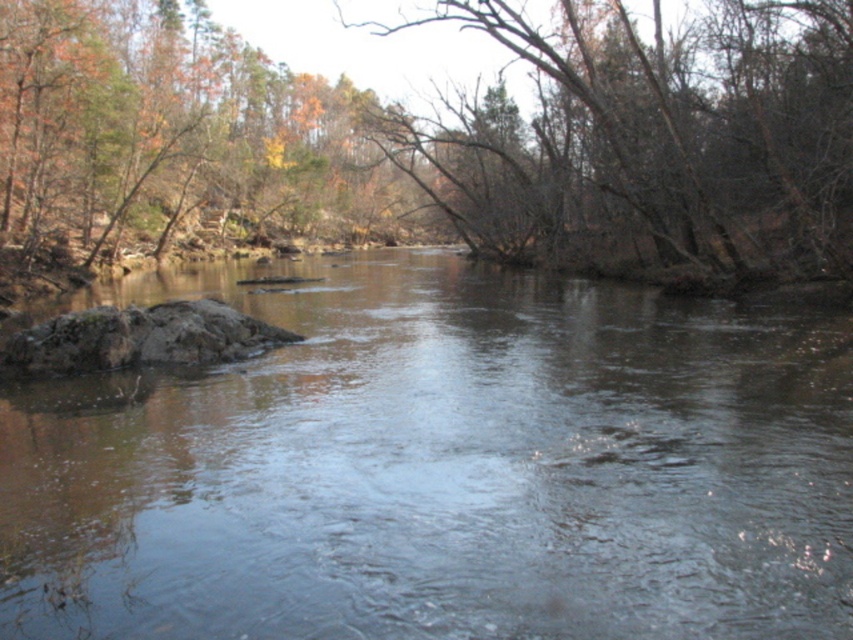
Question: Is brown smooth rock at left above brown bark tree at upper right?

Choices:
 (A) yes
 (B) no

Answer: (B)

Question: Considering the real-world distances, which object is closest to the brown bark tree at upper right?

Choices:
 (A) brown smooth rock at left
 (B) mossy rock at center-left

Answer: (A)

Question: In this image, where is brown bark tree at upper right located relative to mossy rock at center-left?

Choices:
 (A) right
 (B) left

Answer: (A)

Question: Is brown smooth rock at left above mossy rock at center-left?

Choices:
 (A) no
 (B) yes

Answer: (A)

Question: Which of the following is the closest to the observer?

Choices:
 (A) brown smooth rock at left
 (B) brown bark tree at upper right
 (C) mossy rock at center-left

Answer: (A)

Question: Which object appears farthest from the camera in this image?

Choices:
 (A) mossy rock at center-left
 (B) brown smooth rock at left
 (C) brown bark tree at upper right

Answer: (C)